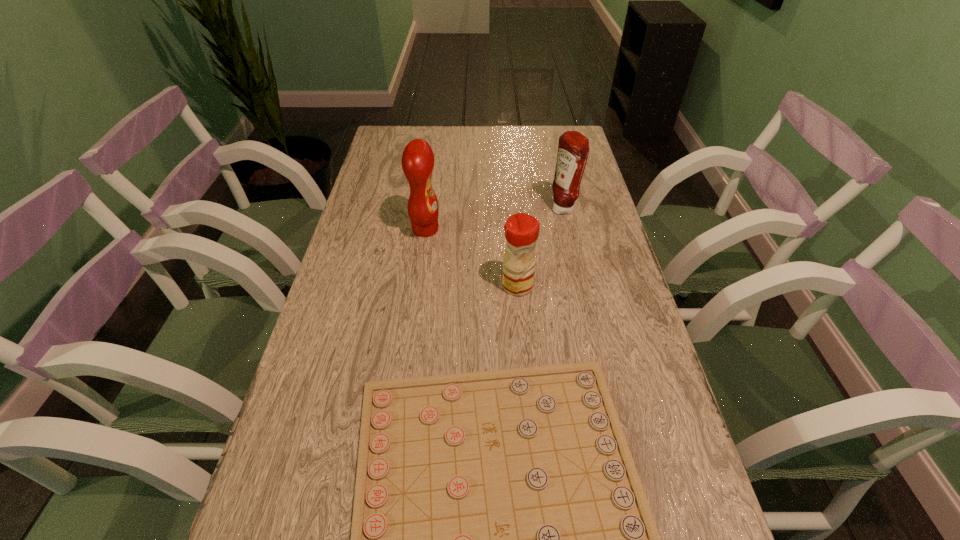
Image resolution: width=960 pixels, height=540 pixels. In order to click on the leftmost condiment in this screenshot , I will do `click(417, 160)`.

Locate an element on the screen. The height and width of the screenshot is (540, 960). the rightmost condiment is located at coordinates (573, 148).

Locate an element on the screen. the nearest condiment is located at coordinates (521, 230).

You are a GUI agent. You are given a task and a screenshot of the screen. Output one action in this format:
    pyautogui.click(x=<x>, y=<y>)
    Task: Click on the third tallest object
    
    Given the screenshot: What is the action you would take?
    pyautogui.click(x=521, y=230)

At what (x,y) coordinates should I click in order to perform the action: click on blank space located on the label side of the leftmost condiment. Please return your answer as a coordinate pair (x, y). The image size is (960, 540). Looking at the image, I should click on (571, 230).

In order to click on vacant space located on the back of the rightmost condiment in this screenshot , I will do `click(559, 188)`.

The height and width of the screenshot is (540, 960). I want to click on free region located on the back of the third tallest object, so click(x=510, y=190).

Identify the location of object that is at the right edge. The height and width of the screenshot is (540, 960). (573, 148).

Where is `vacant space at the far edge of the desktop`? This screenshot has height=540, width=960. vacant space at the far edge of the desktop is located at coordinates (446, 131).

This screenshot has height=540, width=960. In the image, there is a desktop. Identify the location of vacant space at the left edge. (404, 192).